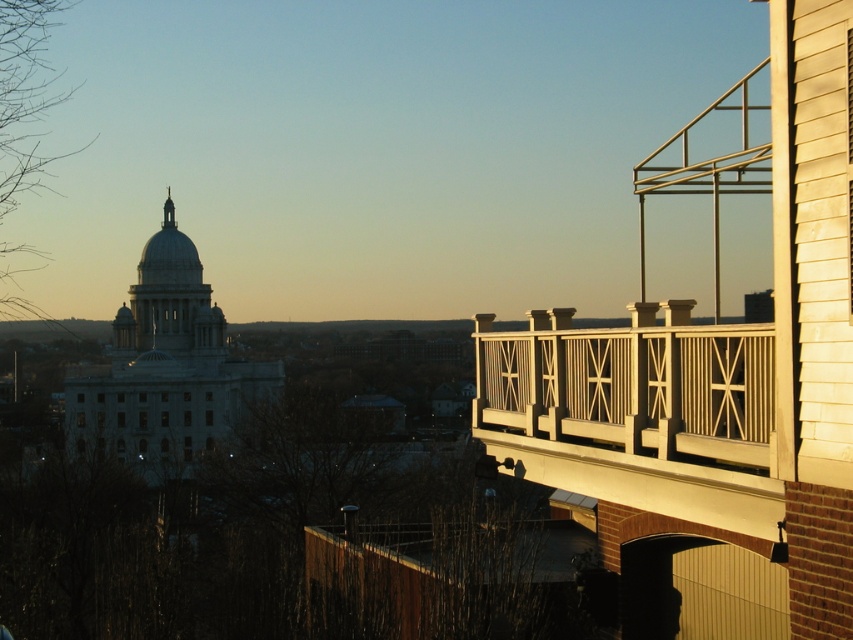
You are an architect analyzing the building layout. Based on the scene, is the white painted wood balcony at upper right positioned above or below the white smooth dome at upper center?

The white painted wood balcony at upper right is located below the white smooth dome at upper center, so it is positioned below it.

You are an architect analyzing the building facade. Which object, the white painted wood balcony at upper right or the white smooth dome at upper center, has a greater height measurement?

The white smooth dome at upper center is taller than the white painted wood balcony at upper right.

From the picture: You are standing at the point with coordinates (631, 392) in the image. What object is located at this point?

The white painted wood balcony at upper right is located at point (631, 392).